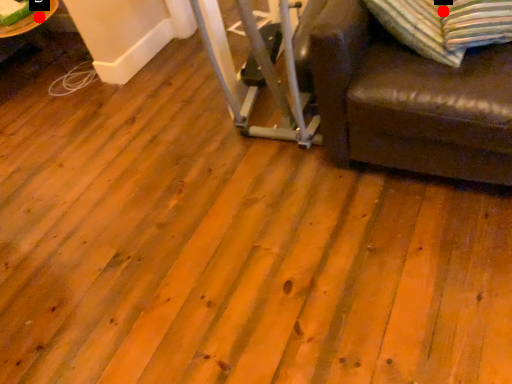
Question: Two points are circled on the image, labeled by A and B beside each circle. Among these points, which one is nearest to the camera?

Choices:
 (A) A is closer
 (B) B is closer

Answer: (A)